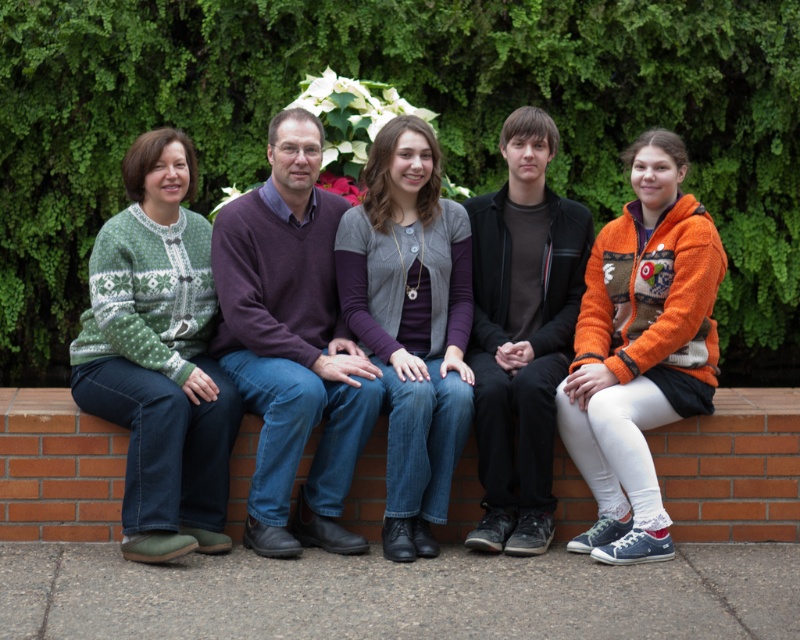
Question: Which object is positioned closest to the green knitted sweater at left?

Choices:
 (A) brick at center
 (B) orange fuzzy sweater at right

Answer: (B)

Question: Which of the following is the closest to the observer?

Choices:
 (A) (230, 273)
 (B) (674, 157)

Answer: (B)

Question: Which object is farther from the camera taking this photo?

Choices:
 (A) brick at center
 (B) green knitted sweater at left
 (C) orange fuzzy sweater at right

Answer: (A)

Question: Can you confirm if green knitted sweater at left is positioned to the right of orange fuzzy sweater at right?

Choices:
 (A) yes
 (B) no

Answer: (B)

Question: Is green knitted sweater at left positioned at the back of orange fuzzy sweater at right?

Choices:
 (A) no
 (B) yes

Answer: (B)

Question: Can you confirm if green knitted sweater at left is wider than orange fuzzy sweater at right?

Choices:
 (A) no
 (B) yes

Answer: (B)